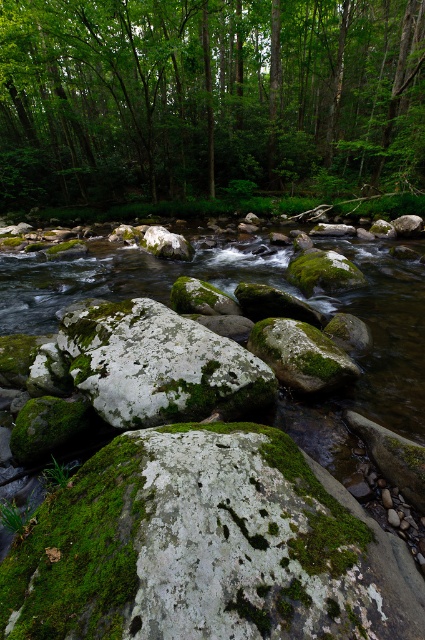
Does point (192, 179) come behind point (257, 323)?

Yes, point (192, 179) is behind point (257, 323).

Consider the image. Does green leafy tree at upper center lie in front of green mossy rock at center?

No, it is not.

Which is in front, point (359, 76) or point (285, 358)?

Positioned in front is point (285, 358).

Image resolution: width=425 pixels, height=640 pixels. What are the coordinates of `green leafy tree at upper center` in the screenshot? It's located at (206, 96).